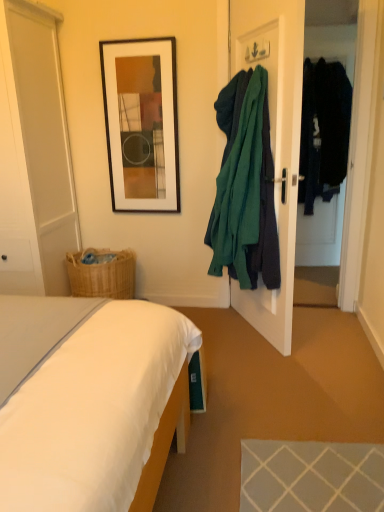
Where is `free space underneath dark blue fabric coat at right, arranged as the 2th clothing when viewed from the front (from a real-world perspective)`? The image size is (384, 512). free space underneath dark blue fabric coat at right, arranged as the 2th clothing when viewed from the front (from a real-world perspective) is located at coordinates (320, 274).